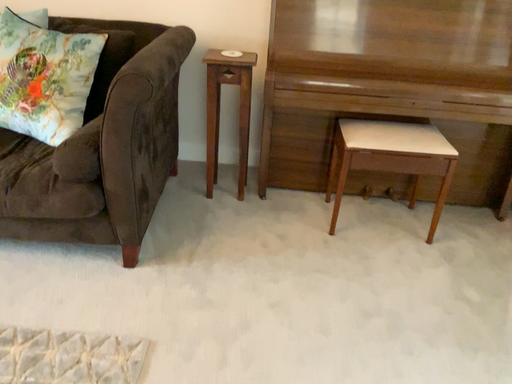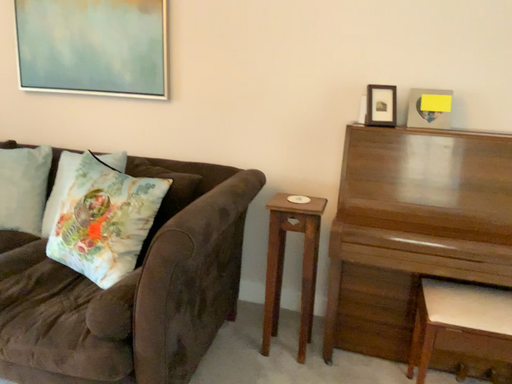
Question: Which way did the camera rotate in the video?

Choices:
 (A) rotated left
 (B) rotated right

Answer: (A)